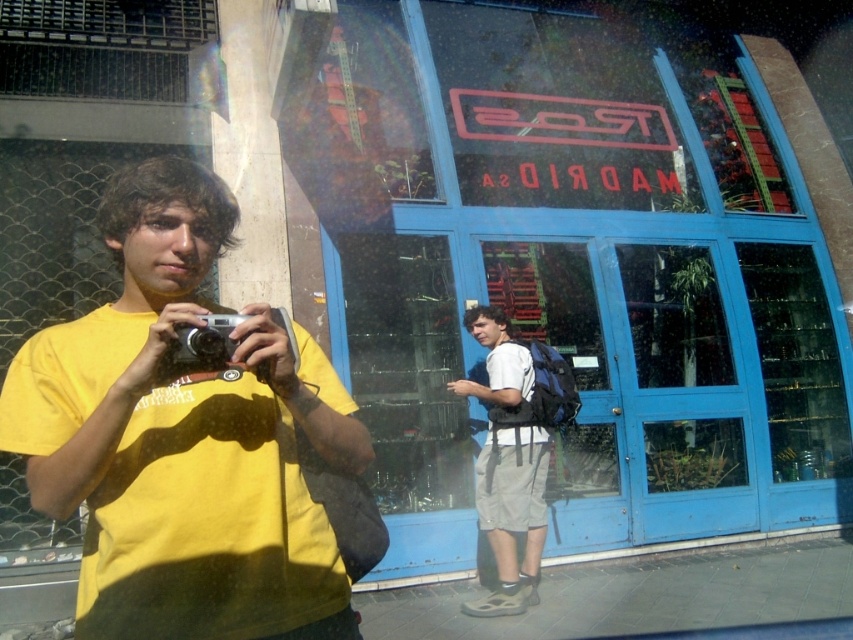
You are trying to take a photo of the MADRID door sign using the silver metallic camera at center. However, there is a white matte backpack at center in the way. Can you still take the photo without moving the backpack?

The silver metallic camera at center is behind the white matte backpack at center, so you cannot take the photo without moving the backpack because the backpack is blocking the camera.

You are planning to place a 2.5 meter long ladder between the white matte backpack at center and the silver metallic camera at center. Will the ladder fit between them without needing to adjust their positions?

The distance between the white matte backpack at center and the silver metallic camera at center is 3.01 meters. Since the ladder is 2.5 meters long, it will fit between them without needing to adjust their positions because the distance is greater than the ladder length.